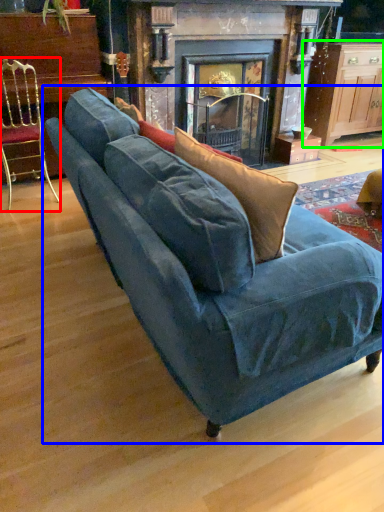
Question: Which object is positioned closest to chair (highlighted by a red box)? Select from studio couch (highlighted by a blue box) and table (highlighted by a green box).

Choices:
 (A) studio couch
 (B) table

Answer: (A)